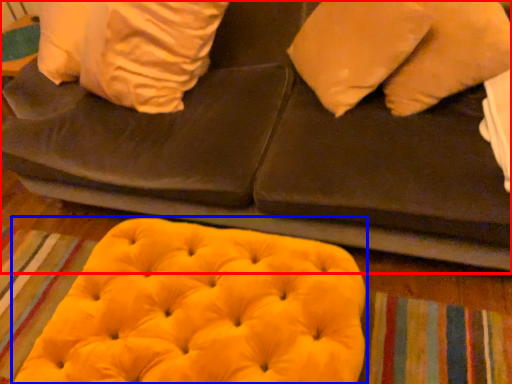
Question: Which of the following is the closest to the observer, furniture (highlighted by a red box) or bean bag chair (highlighted by a blue box)?

Choices:
 (A) furniture
 (B) bean bag chair

Answer: (A)